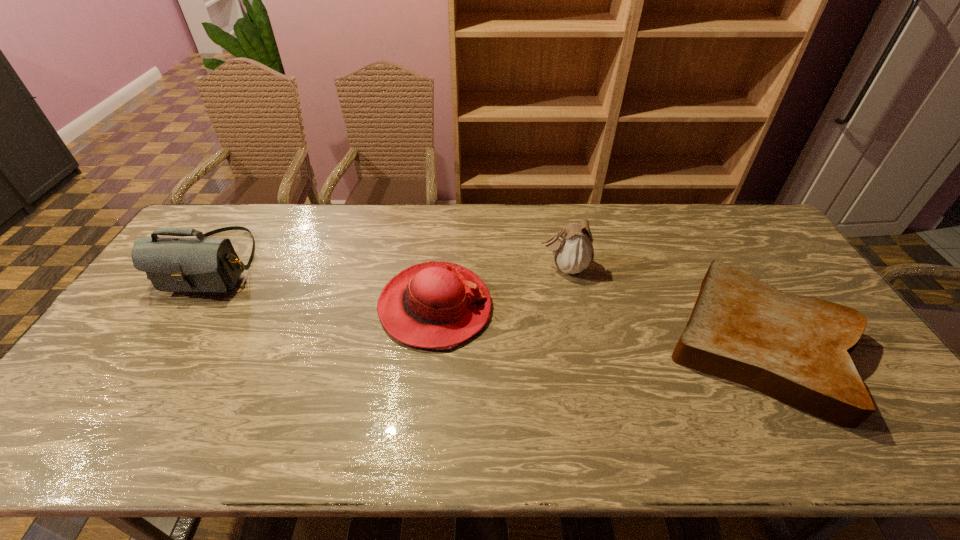
Image resolution: width=960 pixels, height=540 pixels. I want to click on free location at the left edge, so click(172, 331).

Where is `vacant region at the far right corner`? The width and height of the screenshot is (960, 540). vacant region at the far right corner is located at coordinates (743, 214).

At what (x,y) coordinates should I click in order to perform the action: click on vacant region between the leftmost object and the second object from left to right. Please return your answer as a coordinate pair (x, y). The width and height of the screenshot is (960, 540). Looking at the image, I should click on (324, 285).

This screenshot has width=960, height=540. Identify the location of vacant space in between the second object from left to right and the rightmost object. (597, 325).

At what (x,y) coordinates should I click in order to perform the action: click on unoccupied area between the third object from left to right and the shoulder bag. Please return your answer as a coordinate pair (x, y). Looking at the image, I should click on (390, 265).

Where is `free space between the pouch and the rightmost object`? free space between the pouch and the rightmost object is located at coordinates (662, 305).

The image size is (960, 540). What are the coordinates of `empty space that is in between the shortest object and the pouch` in the screenshot? It's located at (662, 305).

Image resolution: width=960 pixels, height=540 pixels. In order to click on blank region between the hat and the shoulder bag in this screenshot , I will do `click(324, 285)`.

In order to click on vacant space that is in between the shoulder bag and the third object from right to left in this screenshot , I will do `click(324, 285)`.

The width and height of the screenshot is (960, 540). Identify the location of empty space between the rightmost object and the hat. (597, 325).